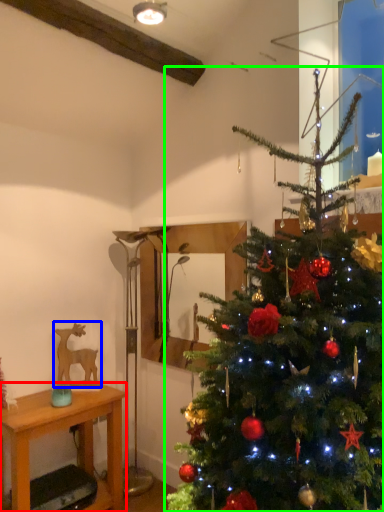
Question: Based on their relative distances, which object is nearer to desk (highlighted by a red box)? Choose from animal (highlighted by a blue box) and christmas tree (highlighted by a green box).

Choices:
 (A) animal
 (B) christmas tree

Answer: (A)